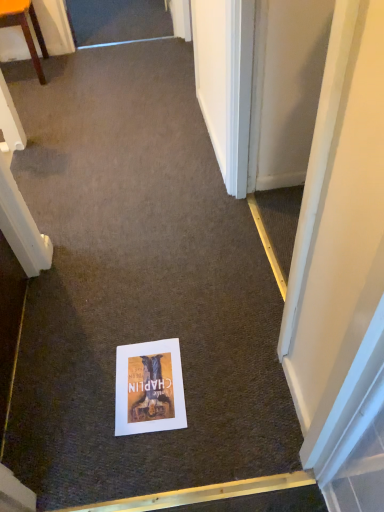
At what (x,y) coordinates should I click in order to perform the action: click on free location to the right of wooden chair at upper left. Please return your answer as a coordinate pair (x, y). Looking at the image, I should click on (86, 69).